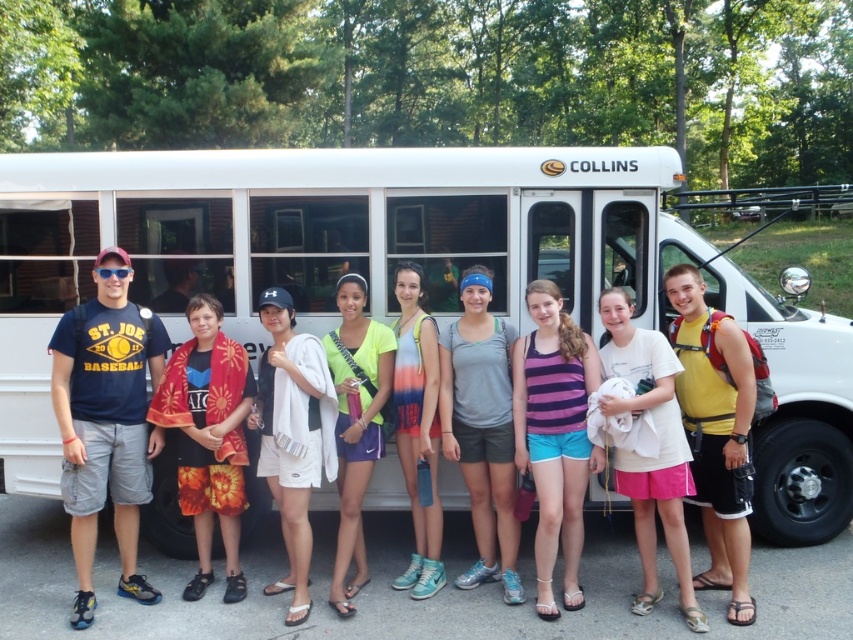
Question: Among these objects, which one is farthest from the camera?

Choices:
 (A) white cotton shirt at center
 (B) white matte school bus at center

Answer: (B)

Question: Where is white matte school bus at center located in relation to white cotton shorts at center in the image?

Choices:
 (A) right
 (B) left

Answer: (B)

Question: Considering the real-world distances, which object is closest to the white cotton shorts at center?

Choices:
 (A) floral towel at center
 (B) white cotton shirt at center
 (C) purple striped tank top at center

Answer: (A)

Question: Is floral towel at center to the right of white cotton shirt at center from the viewer's perspective?

Choices:
 (A) no
 (B) yes

Answer: (A)

Question: Is purple striped tank top at center in front of floral towel at center?

Choices:
 (A) yes
 (B) no

Answer: (A)

Question: Which point is closer to the camera taking this photo?

Choices:
 (A) (654, 342)
 (B) (42, 474)
 (C) (331, 429)

Answer: (A)